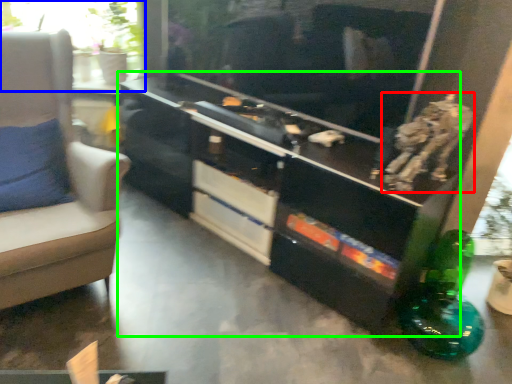
Question: Which object is positioned farthest from animal (highlighted by a red box)? Select from window (highlighted by a blue box) and entertainment center (highlighted by a green box).

Choices:
 (A) window
 (B) entertainment center

Answer: (A)